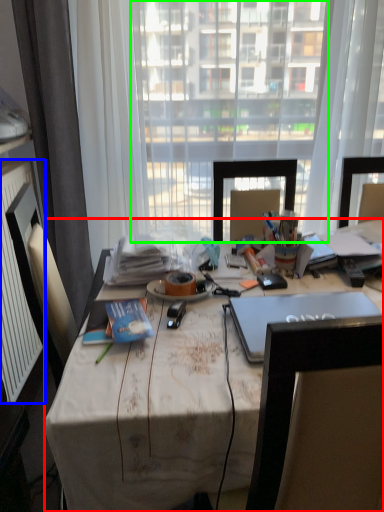
Question: Which object is the farthest from desk (highlighted by a red box)? Choose among these: radiator (highlighted by a blue box) or window screen (highlighted by a green box).

Choices:
 (A) radiator
 (B) window screen

Answer: (B)